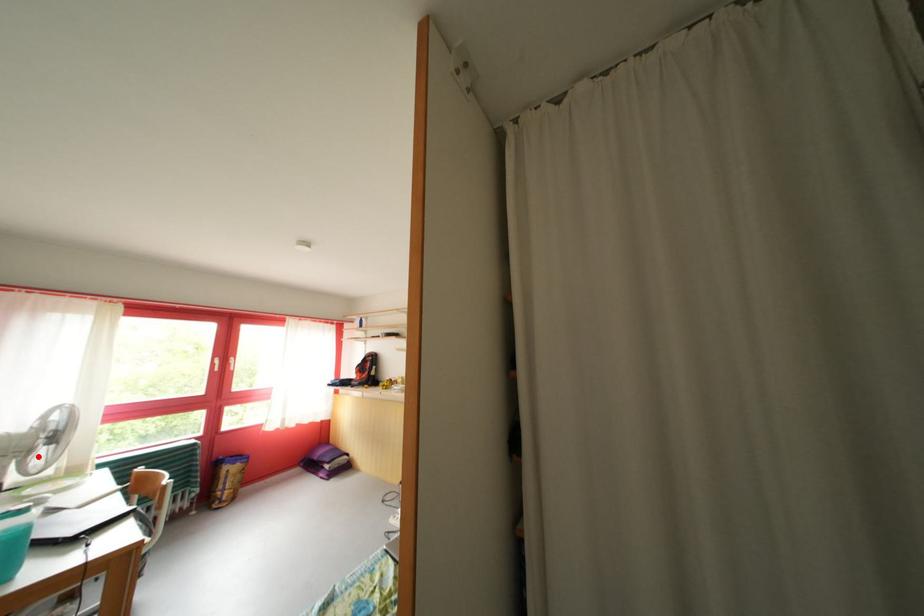
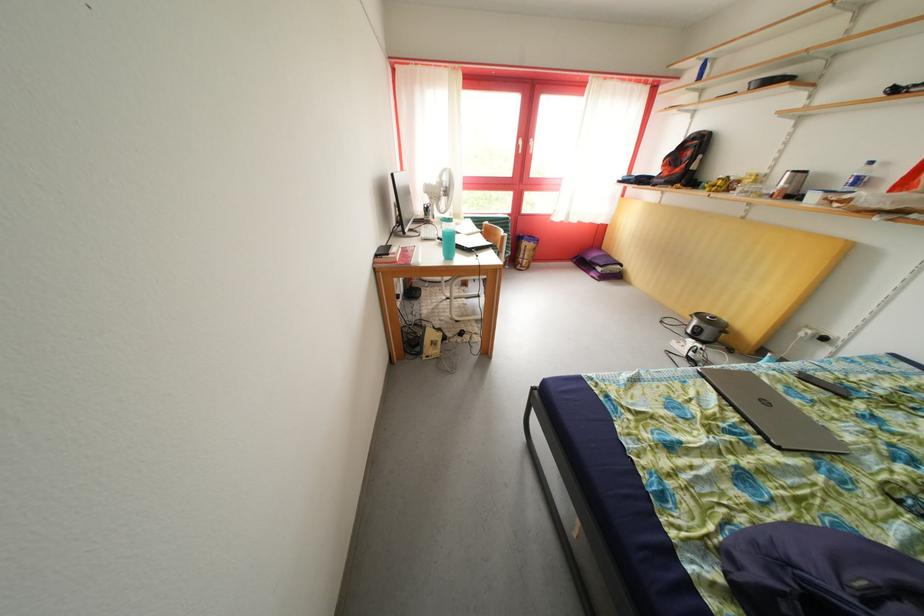
Where in the second image is the point corresponding to the highlighted location from the first image?

(446, 204)